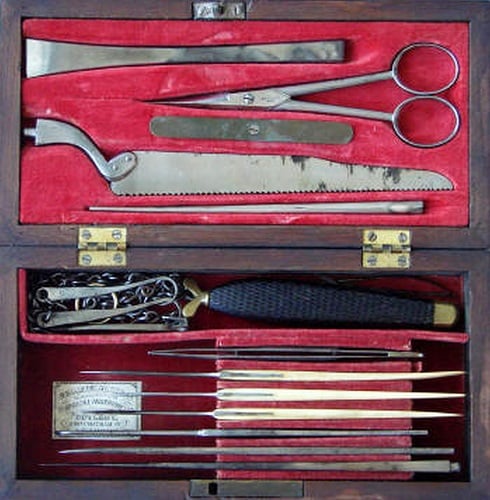
Locate an element on the screen. Image resolution: width=490 pixels, height=500 pixels. wood case is located at coordinates (355, 491), (478, 342), (10, 347), (11, 126), (150, 12), (408, 5), (116, 486).